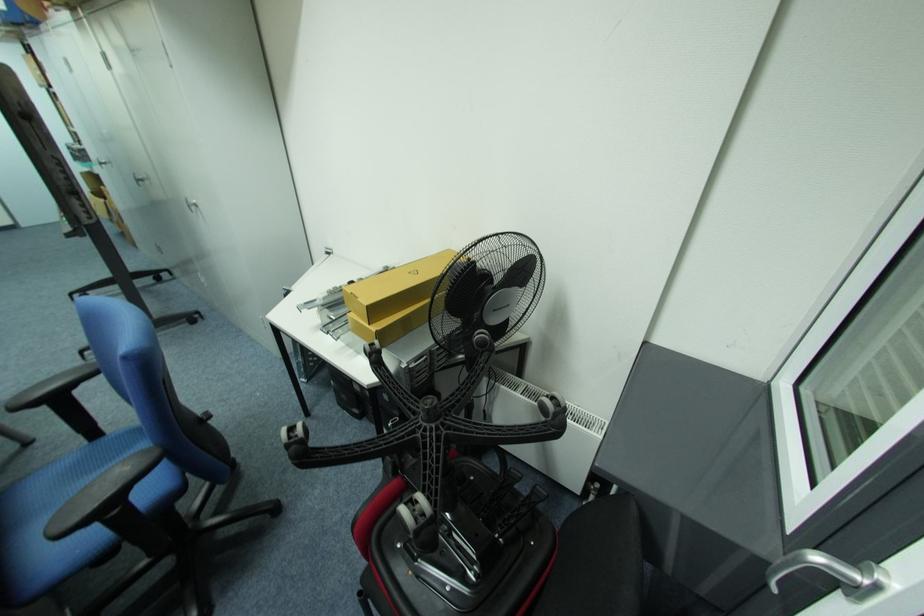
Find the location of a particular element. silver door handle is located at coordinates (831, 573).